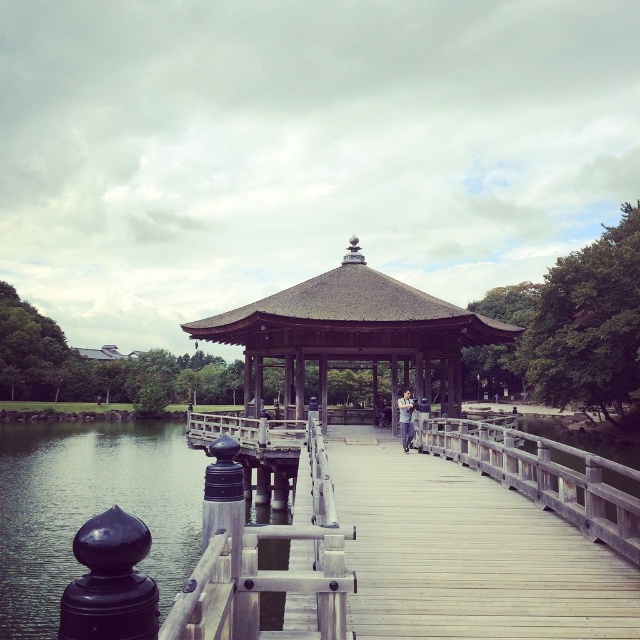
From the picture: Does brown wooden gazebo at center appear on the right side of wooden at center?

In fact, brown wooden gazebo at center is to the left of wooden at center.

Which is above, brown wooden gazebo at center or wooden at center?

brown wooden gazebo at center is higher up.

Between point (358, 260) and point (560, 484), which one is positioned in front?

Point (560, 484)

Find the location of `brown wooden gazebo at center`. brown wooden gazebo at center is located at coordinates (349, 332).